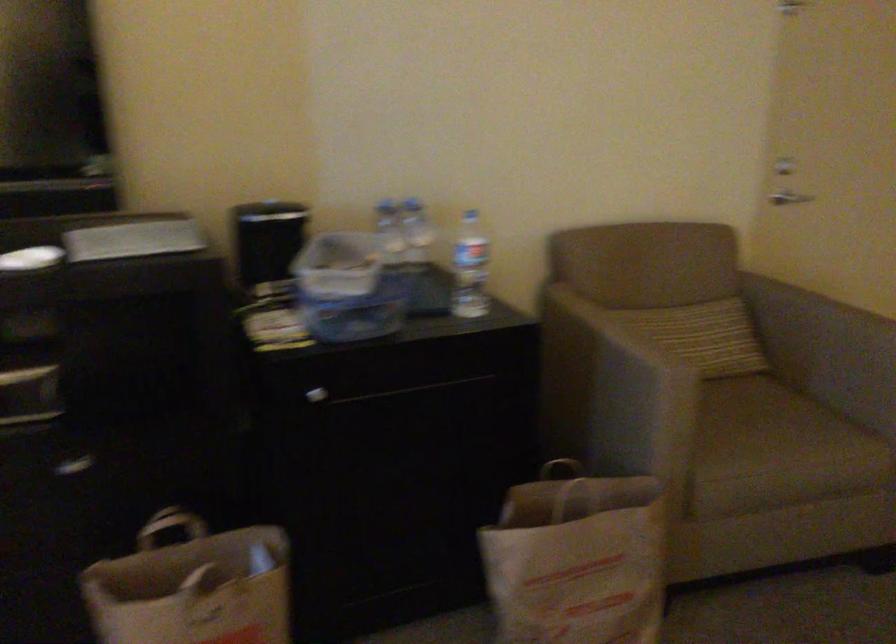
The height and width of the screenshot is (644, 896). I want to click on chair armrest, so click(x=807, y=308).